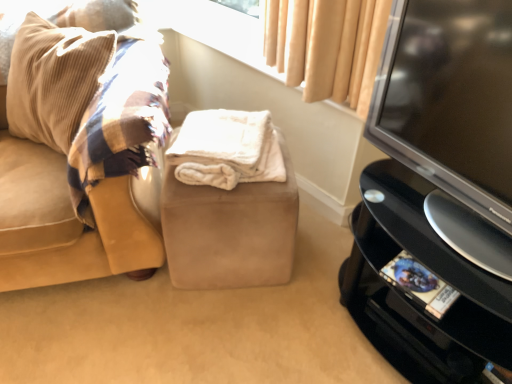
Where is `free point below black glossy television at right (from a real-world perspective)`? This screenshot has height=384, width=512. free point below black glossy television at right (from a real-world perspective) is located at coordinates (409, 186).